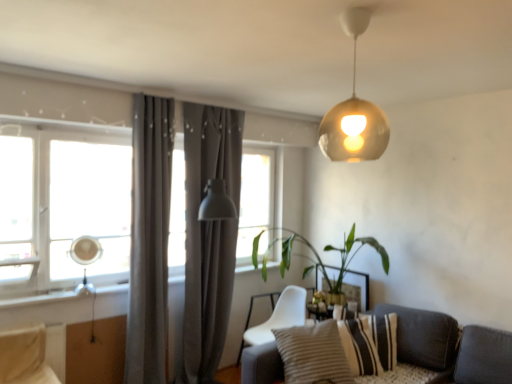
Measure the distance between point (x=9, y=255) and camera.

Point (x=9, y=255) is 2.96 meters away from camera.

This screenshot has height=384, width=512. Describe the element at coordinates (149, 240) in the screenshot. I see `gray fabric curtain at left, the second curtain positioned from the back` at that location.

Describe the element at coordinates (25, 357) in the screenshot. The width and height of the screenshot is (512, 384). I see `beige fabric swivel chair at lower left` at that location.

What is the approximate height of beige fabric swivel chair at lower left?

15.82 inches.

Measure the distance between white fabric chair at lower center and camera.

They are 3.11 meters apart.

You are a GUI agent. You are given a task and a screenshot of the screen. Output one action in this format:
    pyautogui.click(x=<x>, y=<y>)
    Task: Click on the gold metallic sphere at upper center
    Image resolution: width=512 pixels, height=384 pixels.
    Given the screenshot: What is the action you would take?
    pyautogui.click(x=354, y=111)

This screenshot has width=512, height=384. What are the coordinates of `transparent glass window at left` in the screenshot? It's located at coord(62,208).

Visually, is beige fabric swivel chair at lower left positioned to the left or to the right of transparent glass window at left?

Based on their positions, beige fabric swivel chair at lower left is located to the left of transparent glass window at left.

Can you confirm if beige fabric swivel chair at lower left is bigger than transparent glass window at left?

No, beige fabric swivel chair at lower left is not bigger than transparent glass window at left.

In terms of width, does beige fabric swivel chair at lower left look wider or thinner when compared to transparent glass window at left?

beige fabric swivel chair at lower left is wider than transparent glass window at left.

What's the angular difference between beige fabric swivel chair at lower left and transparent glass window at left's facing directions?

The angle between the facing direction of beige fabric swivel chair at lower left and the facing direction of transparent glass window at left is 0.752 degrees.

Between green leafy plant at center and striped fabric pillow at lower right, the first pillow positioned from the back, which one appears on the left side from the viewer's perspective?

Positioned to the left is green leafy plant at center.

How far apart are green leafy plant at center and striped fabric pillow at lower right, the first pillow positioned from the back?

green leafy plant at center and striped fabric pillow at lower right, the first pillow positioned from the back, are 35.38 inches apart.

Which point is more distant from viewer, (262, 232) or (352, 356)?

The point (262, 232) is more distant.

Considering the positions of objects striped fabric pillow at lower right, the first pillow positioned from the back, and gray fabric curtain at left, the second curtain positioned from the back, in the image provided, who is more to the left, striped fabric pillow at lower right, the first pillow positioned from the back, or gray fabric curtain at left, the second curtain positioned from the back,?

From the viewer's perspective, gray fabric curtain at left, the second curtain positioned from the back, appears more on the left side.

Considering the sizes of objects striped fabric pillow at lower right, the first pillow positioned from the back, and gray fabric curtain at left, the second curtain positioned from the back, in the image provided, who is bigger, striped fabric pillow at lower right, the first pillow positioned from the back, or gray fabric curtain at left, the second curtain positioned from the back,?

Bigger between the two is gray fabric curtain at left, the second curtain positioned from the back.

Is striped fabric pillow at lower right, which is counted as the 2th pillow, starting from the front, not near gray fabric curtain at left, which ranks as the 1th curtain in front-to-back order?

striped fabric pillow at lower right, which is counted as the 2th pillow, starting from the front, is positioned a significant distance from gray fabric curtain at left, which ranks as the 1th curtain in front-to-back order.

Locate an element on the screen. This screenshot has height=384, width=512. the 2nd pillow below the gray fabric curtain at left, which ranks as the 1th curtain in front-to-back order (from the image's perspective) is located at coordinates (370, 343).

At what (x,y) coordinates should I click in order to perform the action: click on the 1st pillow counting from the right of the gray fabric curtain at left, which ranks as the 1th curtain in front-to-back order. Please return your answer as a coordinate pair (x, y). The image size is (512, 384). Looking at the image, I should click on (313, 354).

Considering the points (317, 376) and (131, 232), which point is in front, point (317, 376) or point (131, 232)?

The point (317, 376) is closer.

Is striped fabric pillow at lower right, the second pillow positioned from the back, aimed at gray fabric curtain at left, the second curtain positioned from the back?

No, striped fabric pillow at lower right, the second pillow positioned from the back, is not turned towards gray fabric curtain at left, the second curtain positioned from the back.

From the image's perspective, would you say striped fabric pillow at lower right, the second pillow positioned from the back, is shown under gray fabric curtain at left, which ranks as the 1th curtain in front-to-back order?

Correct, striped fabric pillow at lower right, the second pillow positioned from the back, appears lower than gray fabric curtain at left, which ranks as the 1th curtain in front-to-back order, in the image.

Does gold metallic sphere at upper center have a lesser height compared to gray fabric curtain at left, the second curtain positioned from the back?

Yes, gold metallic sphere at upper center is shorter than gray fabric curtain at left, the second curtain positioned from the back.

Between point (337, 154) and point (145, 159), which one is positioned behind?

The point (145, 159) is more distant.

Image resolution: width=512 pixels, height=384 pixels. Identify the location of lamp above the gray fabric curtain at left, which ranks as the 1th curtain in front-to-back order (from a real-world perspective). (354, 111).

Is gold metallic sphere at upper center at the right side of gray fabric curtain at left, which ranks as the 1th curtain in front-to-back order?

Indeed, gold metallic sphere at upper center is positioned on the right side of gray fabric curtain at left, which ranks as the 1th curtain in front-to-back order.

Considering the positions of objects beige fabric swivel chair at lower left and matte gray curtain at center, which is the first curtain in back-to-front order, in the image provided, who is behind, beige fabric swivel chair at lower left or matte gray curtain at center, which is the first curtain in back-to-front order,?

matte gray curtain at center, which is the first curtain in back-to-front order, is more distant.

Is beige fabric swivel chair at lower left facing away from matte gray curtain at center, which is counted as the 2th curtain, starting from the front?

No, beige fabric swivel chair at lower left is not facing the opposite direction of matte gray curtain at center, which is counted as the 2th curtain, starting from the front.

Image resolution: width=512 pixels, height=384 pixels. Identify the location of swivel chair beneath the matte gray curtain at center, which is the first curtain in back-to-front order (from a real-world perspective). (25, 357).

Which object is positioned more to the right, beige fabric swivel chair at lower left or matte gray curtain at center, which is the first curtain in back-to-front order?

matte gray curtain at center, which is the first curtain in back-to-front order, is more to the right.

Is striped fabric pillow at lower right, the first pillow positioned from the back, touching matte gray curtain at center, which is the first curtain in back-to-front order?

No, striped fabric pillow at lower right, the first pillow positioned from the back, is not making contact with matte gray curtain at center, which is the first curtain in back-to-front order.

From the image's perspective, which object appears higher, striped fabric pillow at lower right, which is counted as the 2th pillow, starting from the front, or matte gray curtain at center, which is counted as the 2th curtain, starting from the front?

matte gray curtain at center, which is counted as the 2th curtain, starting from the front, appears higher in the image.

From a real-world perspective, is striped fabric pillow at lower right, which is counted as the 2th pillow, starting from the front, positioned above or below matte gray curtain at center, which is counted as the 2th curtain, starting from the front?

In terms of real-world spatial position, striped fabric pillow at lower right, which is counted as the 2th pillow, starting from the front, is below matte gray curtain at center, which is counted as the 2th curtain, starting from the front.

At what (x,y) coordinates should I click in order to perform the action: click on window above the beige fabric swivel chair at lower left (from a real-world perspective). Please return your answer as a coordinate pair (x, y). Looking at the image, I should click on (62, 208).

You are a GUI agent. You are given a task and a screenshot of the screen. Output one action in this format:
    pyautogui.click(x=<x>, y=<y>)
    Task: Click on the pillow that is the 2nd one when counting downward from the green leafy plant at center (from the image's perspective)
    
    Given the screenshot: What is the action you would take?
    pyautogui.click(x=370, y=343)

From the image, which object appears to be nearer to gray fabric curtain at left, which ranks as the 1th curtain in front-to-back order, matte silver table lamp at left or striped fabric pillow at lower right, the first pillow positioned from the back?

The object closer to gray fabric curtain at left, which ranks as the 1th curtain in front-to-back order, is matte silver table lamp at left.

Looking at the image, which one is located further to matte gray curtain at center, which is the first curtain in back-to-front order, striped fabric pillow at lower right, the second pillow positioned from the back, or matte silver table lamp at left?

striped fabric pillow at lower right, the second pillow positioned from the back.

Looking at the image, which one is located further to white fabric chair at lower center, green leafy plant at center or beige fabric swivel chair at lower left?

beige fabric swivel chair at lower left is further to white fabric chair at lower center.

Which object lies further to the anchor point gray fabric curtain at left, which ranks as the 1th curtain in front-to-back order, beige fabric swivel chair at lower left or striped fabric pillow at lower right, which is counted as the 2th pillow, starting from the front?

striped fabric pillow at lower right, which is counted as the 2th pillow, starting from the front, is further to gray fabric curtain at left, which ranks as the 1th curtain in front-to-back order.

When comparing their distances from striped fabric pillow at lower right, which is counted as the 2th pillow, starting from the front, does gray fabric curtain at left, which ranks as the 1th curtain in front-to-back order, or matte silver table lamp at left seem further?

Based on the image, matte silver table lamp at left appears to be further to striped fabric pillow at lower right, which is counted as the 2th pillow, starting from the front.

From the image, which object appears to be nearer to white fabric chair at lower center, beige fabric swivel chair at lower left or matte silver table lamp at left?

matte silver table lamp at left is closer to white fabric chair at lower center.

Considering their positions, is green leafy plant at center positioned further to matte silver table lamp at left than matte gray curtain at center, which is counted as the 2th curtain, starting from the front?

green leafy plant at center lies further to matte silver table lamp at left than the other object.

Which object lies further to the anchor point textured gray couch at lower right, striped fabric pillow at lower right, which is the first pillow in front-to-back order, or gray fabric curtain at left, the second curtain positioned from the back?

The object further to textured gray couch at lower right is gray fabric curtain at left, the second curtain positioned from the back.

Where is `chair between transparent glass window at left and striped fabric pillow at lower right, the second pillow positioned from the back`? chair between transparent glass window at left and striped fabric pillow at lower right, the second pillow positioned from the back is located at coordinates (276, 316).

This screenshot has width=512, height=384. What are the coordinates of `houseplant between matte silver table lamp at left and textured gray couch at lower right in the horizontal direction` in the screenshot? It's located at pos(318,258).

Find the location of a particular element. This screenshot has width=512, height=384. window situated between gray fabric curtain at left, the second curtain positioned from the back, and striped fabric pillow at lower right, the first pillow positioned from the back, from left to right is located at coordinates (62, 208).

What are the coordinates of `houseplant between gold metallic sphere at upper center and white fabric chair at lower center from front to back` in the screenshot? It's located at (318, 258).